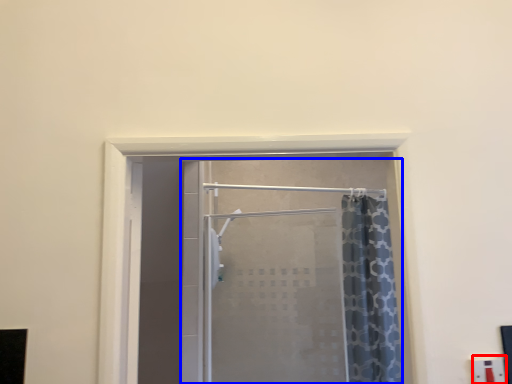
Question: Which object appears farthest to the camera in this image, electric outlet (highlighted by a red box) or door (highlighted by a blue box)?

Choices:
 (A) electric outlet
 (B) door

Answer: (B)